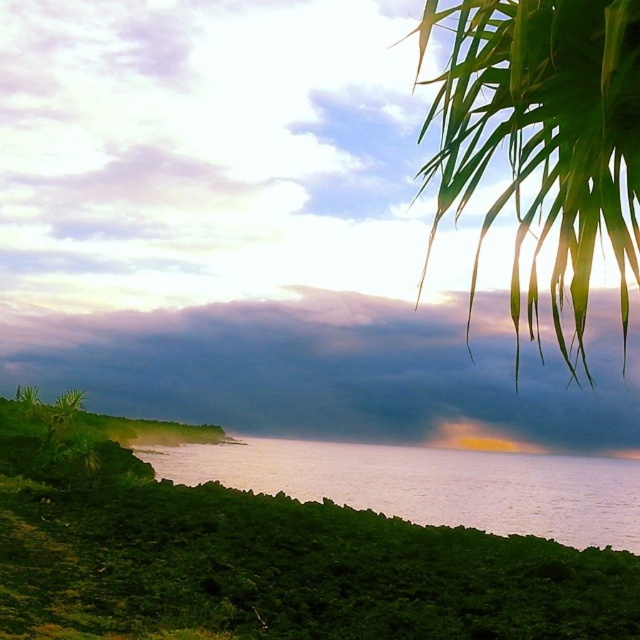
Is dark gray cloud at upper center bigger than green leafy palm at upper right?

Yes, dark gray cloud at upper center is bigger than green leafy palm at upper right.

Is dark gray cloud at upper center positioned at the back of green leafy palm at upper right?

Yes, dark gray cloud at upper center is further from the viewer.

Is point (557, 365) less distant than point (538, 141)?

No, it is not.

This screenshot has width=640, height=640. In order to click on dark gray cloud at upper center in this screenshot , I will do 336,369.

Can you confirm if dark gray cloud at upper center is bigger than smooth water at lower left?

Correct, dark gray cloud at upper center is larger in size than smooth water at lower left.

Who is positioned more to the right, dark gray cloud at upper center or smooth water at lower left?

smooth water at lower left is more to the right.

Who is more distant from viewer, (x=488, y=378) or (x=529, y=525)?

Point (x=488, y=378)

Find the location of `dark gray cloud at upper center`. dark gray cloud at upper center is located at coordinates (336, 369).

Which is more to the left, green leafy palm at upper right or smooth water at lower left?

From the viewer's perspective, smooth water at lower left appears more on the left side.

This screenshot has width=640, height=640. Find the location of `green leafy palm at upper right`. green leafy palm at upper right is located at coordinates (541, 140).

At what (x,y) coordinates should I click in order to perform the action: click on green leafy palm at upper right. Please return your answer as a coordinate pair (x, y). Looking at the image, I should click on (541, 140).